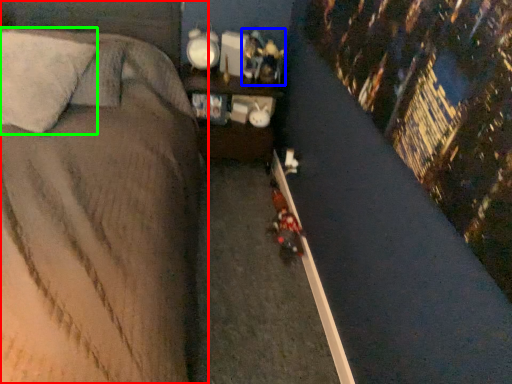
Question: Based on their relative distances, which object is nearer to bed (highlighted by a red box)? Choose from toy (highlighted by a blue box) and pillow (highlighted by a green box).

Choices:
 (A) toy
 (B) pillow

Answer: (B)